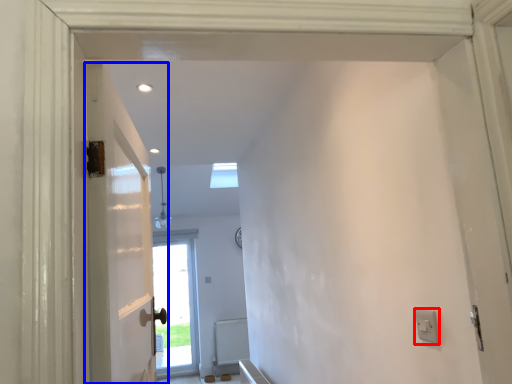
Question: Which of the following is the closest to the observer, electric outlet (highlighted by a red box) or door (highlighted by a blue box)?

Choices:
 (A) electric outlet
 (B) door

Answer: (B)